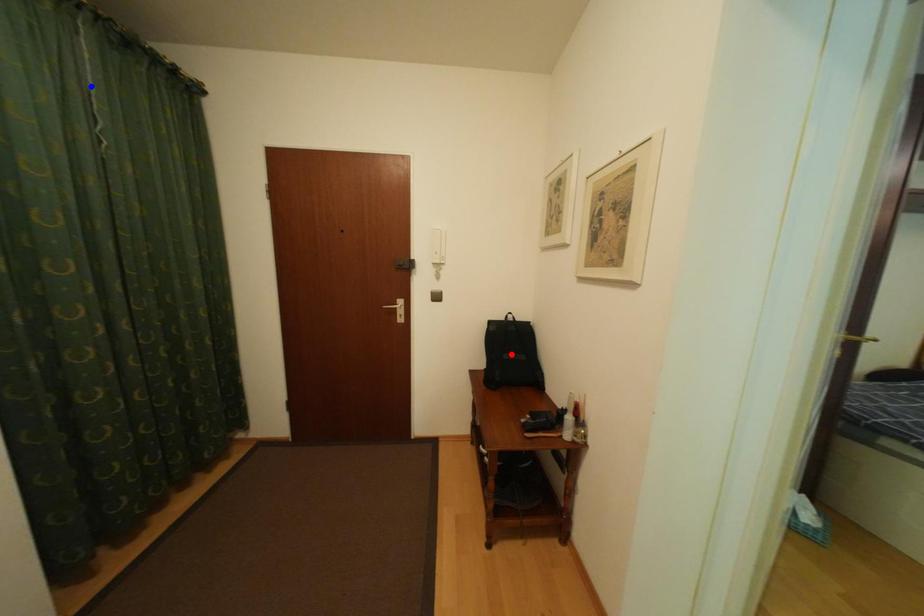
Question: In the image, two points are highlighted. Which point is nearer to the camera? Reply with the corresponding letter.

Choices:
 (A) blue point
 (B) red point

Answer: (A)